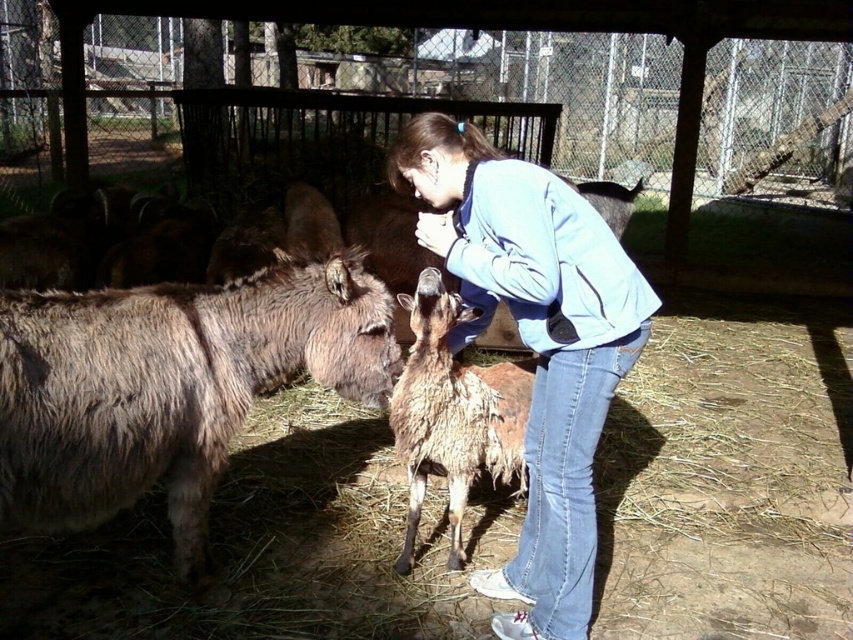
Where is `light blue denim jacket at center`? light blue denim jacket at center is located at coordinates (534, 342).

Can you confirm if light blue denim jacket at center is thinner than fuzzy brown goat at center?

In fact, light blue denim jacket at center might be wider than fuzzy brown goat at center.

Locate an element on the screen. This screenshot has height=640, width=853. light blue denim jacket at center is located at coordinates (534, 342).

From the picture: Is fuzzy brown mule at left to the left of fuzzy brown goat at center from the viewer's perspective?

Yes, fuzzy brown mule at left is to the left of fuzzy brown goat at center.

Is point (160, 369) closer to viewer compared to point (457, 508)?

Yes, it is.

Which is behind, point (32, 307) or point (445, 387)?

The point (445, 387) is behind.

Where is `fuzzy brown mule at left`? fuzzy brown mule at left is located at coordinates (169, 385).

Is fuzzy brown mule at left to the left of light blue denim jacket at center from the viewer's perspective?

Yes, fuzzy brown mule at left is to the left of light blue denim jacket at center.

Describe the element at coordinates (169, 385) in the screenshot. Image resolution: width=853 pixels, height=640 pixels. I see `fuzzy brown mule at left` at that location.

Measure the distance between fuzzy brown mule at left and camera.

A distance of 2.00 meters exists between fuzzy brown mule at left and camera.

At what (x,y) coordinates should I click in order to perform the action: click on fuzzy brown mule at left. Please return your answer as a coordinate pair (x, y). The image size is (853, 640). Looking at the image, I should click on (169, 385).